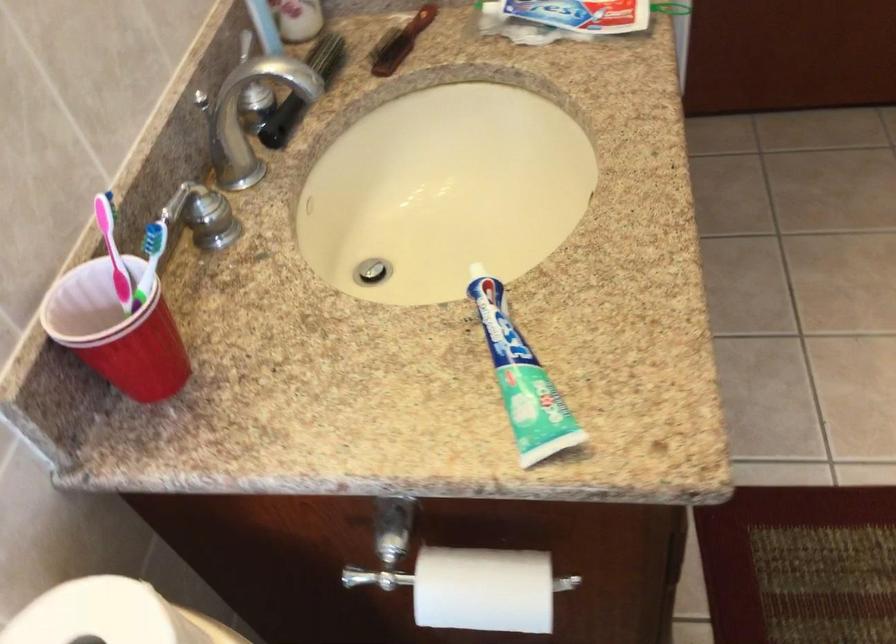
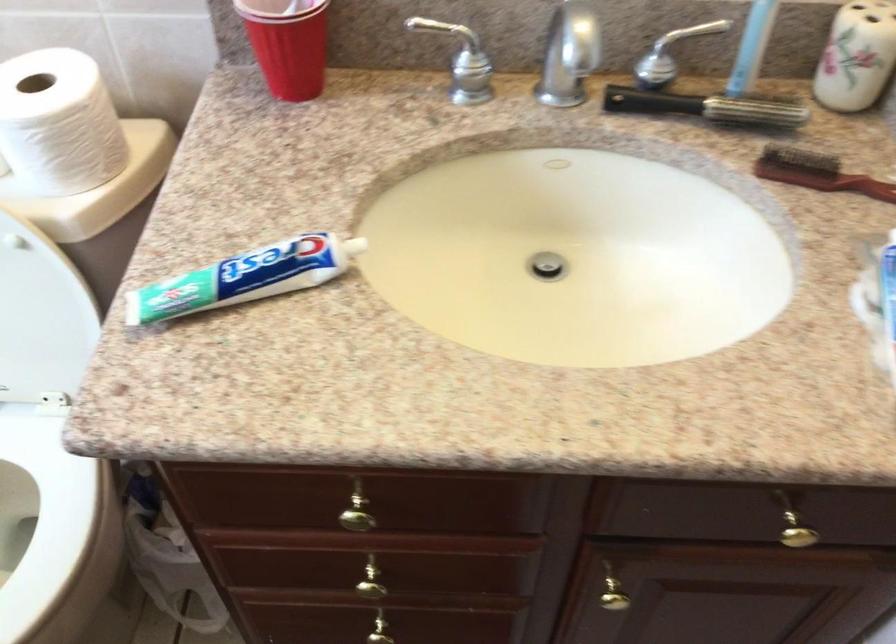
The point at [156,323] is marked in the first image. Where is the corresponding point in the second image?

(288, 44)